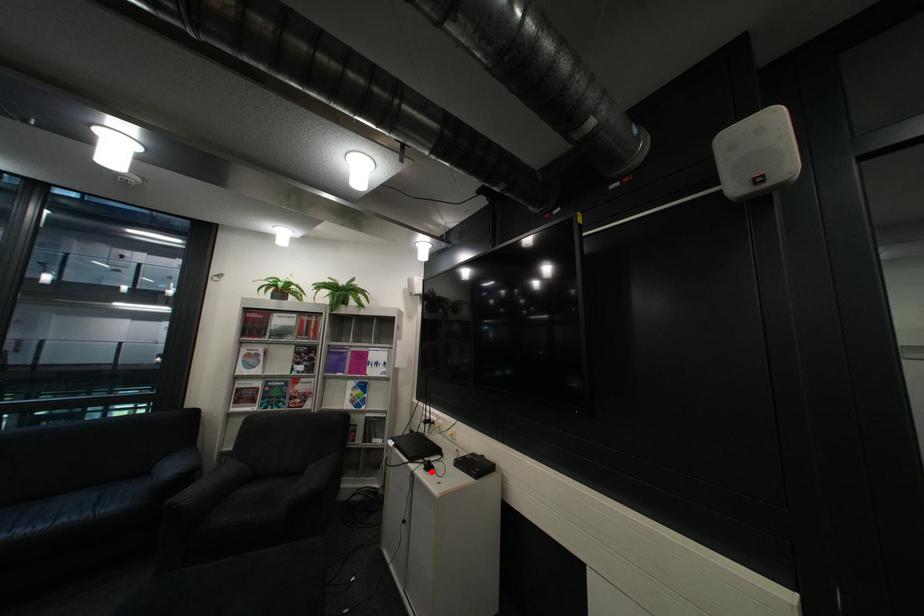
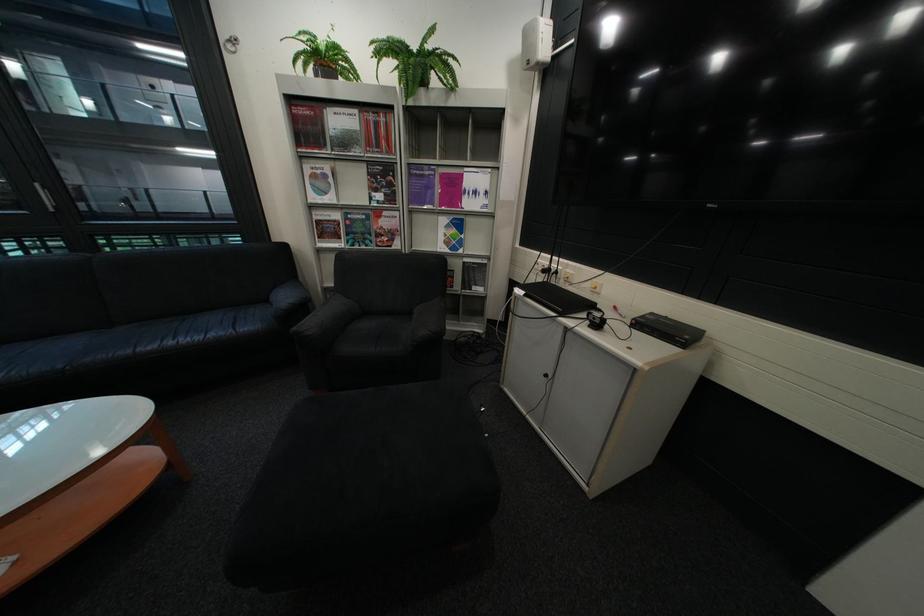
Find the pixel in the second image that matches the highlighted location in the first image.

(592, 329)